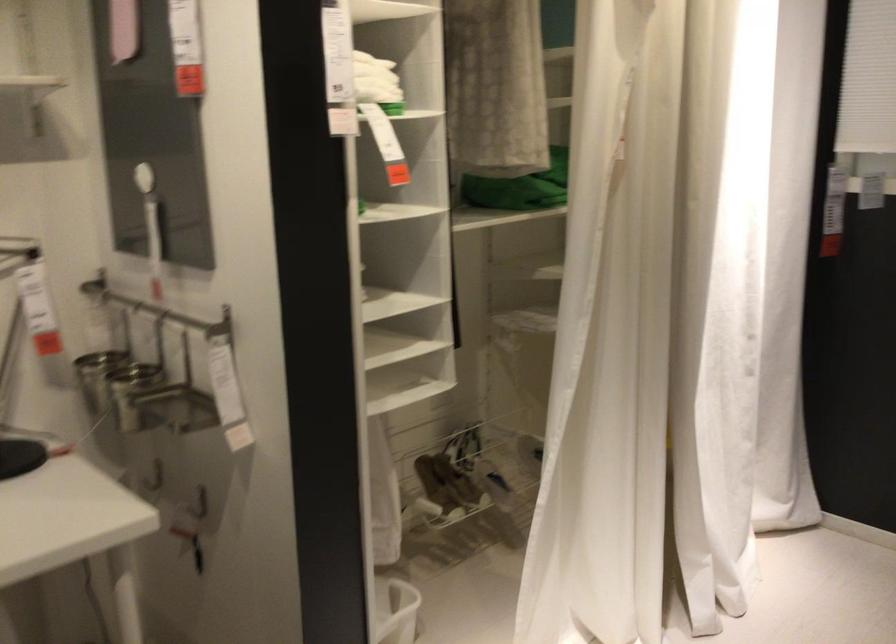
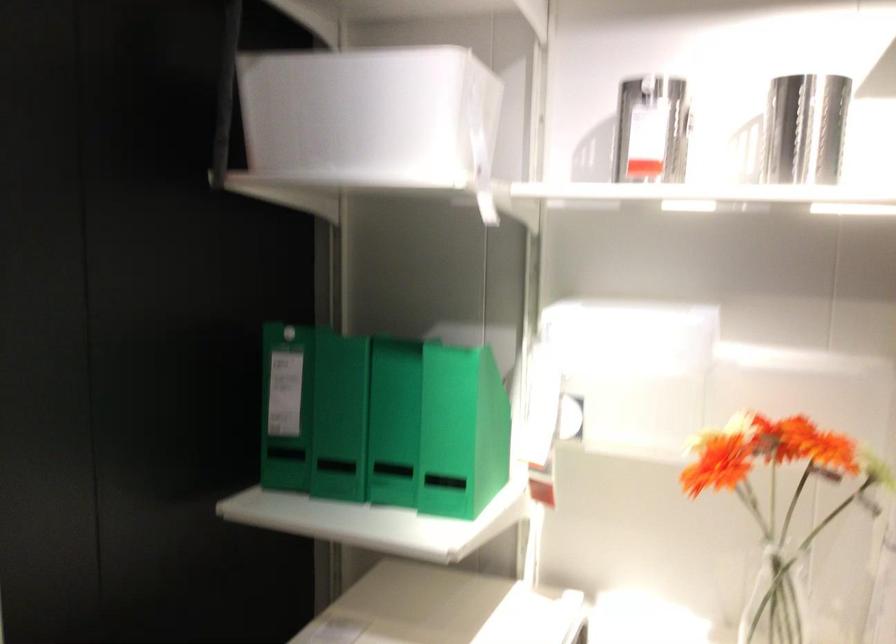
Question: The camera is either moving clockwise (left) or counter-clockwise (right) around the object. The first image is from the beginning of the video and the second image is from the end. Is the camera moving left or right when shooting the video?

Choices:
 (A) Left
 (B) Right

Answer: (B)